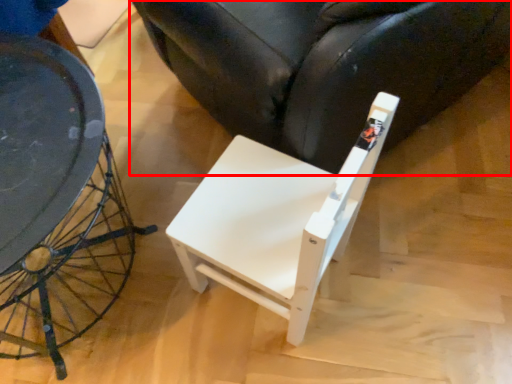
Question: From the image, what is the correct spatial relationship of chair (annotated by the red box) in relation to chair?

Choices:
 (A) left
 (B) right

Answer: (B)